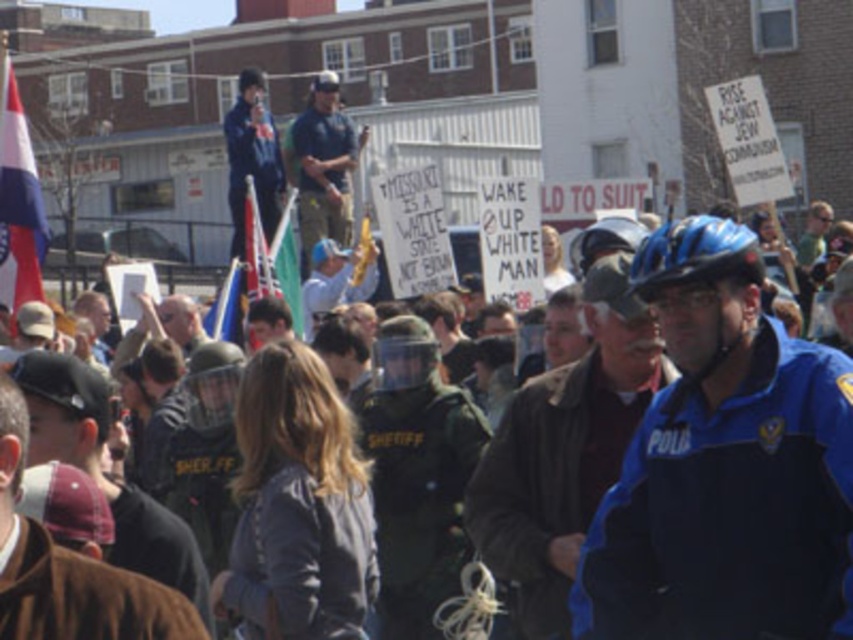
Question: Which point appears closest to the camera in this image?

Choices:
 (A) (706, 227)
 (B) (310, 177)

Answer: (A)

Question: Does blue hardshell helmet at right come behind blue uniformed officer at upper center?

Choices:
 (A) no
 (B) yes

Answer: (A)

Question: Estimate the real-world distances between objects in this image. Which object is farther from the green fabric flag at center?

Choices:
 (A) blue matte bicycle helmet at right
 (B) blue matte bicycle helmet at center

Answer: (B)

Question: Can you confirm if blue matte bicycle helmet at right is bigger than green fabric flag at center?

Choices:
 (A) yes
 (B) no

Answer: (B)

Question: Can you confirm if dark brown leather jacket at center is thinner than green fabric flag at center?

Choices:
 (A) yes
 (B) no

Answer: (A)

Question: Among these points, which one is farthest from the camera?

Choices:
 (A) (10, 163)
 (B) (704, 250)

Answer: (A)